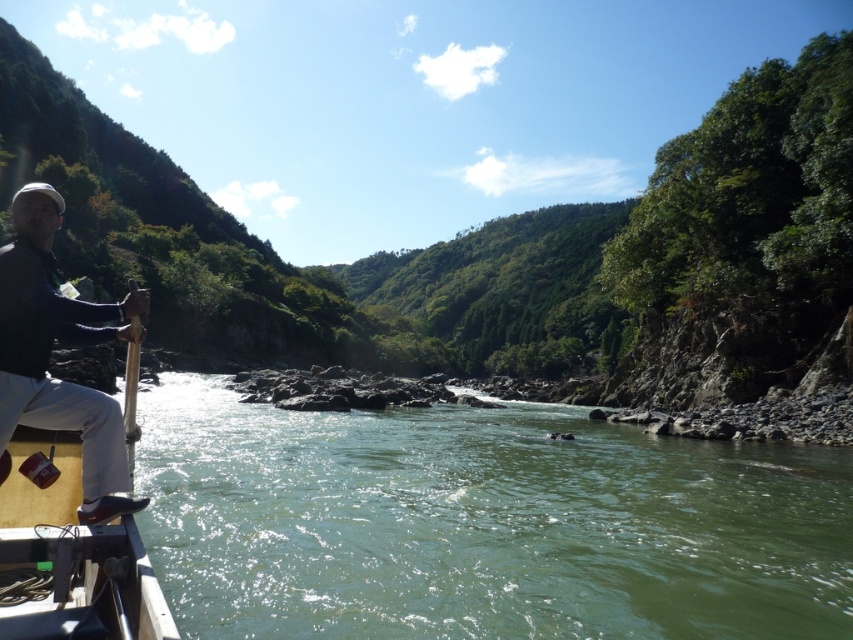
Question: Among these points, which one is nearest to the camera?

Choices:
 (A) (53, 321)
 (B) (334, 561)

Answer: (A)

Question: Can you confirm if green smooth water at center is positioned above matte black jacket at left?

Choices:
 (A) yes
 (B) no

Answer: (B)

Question: Can you confirm if green smooth water at center is positioned below matte black jacket at left?

Choices:
 (A) no
 (B) yes

Answer: (B)

Question: Does green smooth water at center have a smaller size compared to matte black jacket at left?

Choices:
 (A) yes
 (B) no

Answer: (B)